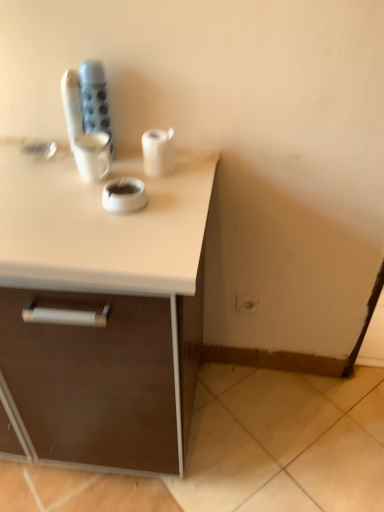
Question: Is white matte paper towel at center in front of or behind white plastic electric outlet at lower right in the image?

Choices:
 (A) behind
 (B) front

Answer: (B)

Question: From the image's perspective, is white matte paper towel at center above or below white plastic electric outlet at lower right?

Choices:
 (A) below
 (B) above

Answer: (B)

Question: Estimate the real-world distances between objects in this image. Which object is closer to the white matte ashtray at center?

Choices:
 (A) white matte paper towel at center
 (B) white plastic electric outlet at lower right

Answer: (A)

Question: Based on their relative distances, which object is nearer to the white plastic electric outlet at lower right?

Choices:
 (A) white matte ashtray at center
 (B) white matte paper towel at center

Answer: (B)